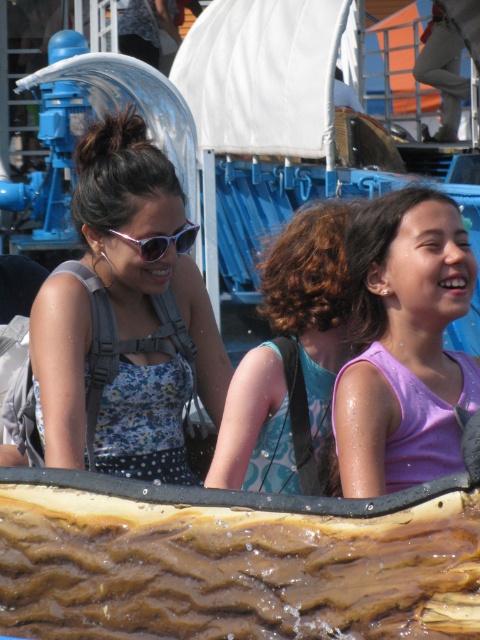
From the picture: Which is more to the right, purple matte tank top at center or teal fabric dress at center?

From the viewer's perspective, purple matte tank top at center appears more on the right side.

Measure the distance between point (408,300) and camera.

Point (408,300) is 32.51 meters from camera.

Is point (392, 227) positioned in front of point (279, 336)?

Yes.

You are a GUI agent. You are given a task and a screenshot of the screen. Output one action in this format:
    pyautogui.click(x=<x>, y=<y>)
    Task: Click on the purple matte tank top at center
    Image resolution: width=480 pixels, height=640 pixels.
    Given the screenshot: What is the action you would take?
    pyautogui.click(x=403, y=340)

Does floral fabric dress at left appear on the right side of purple matte tank top at center?

No, floral fabric dress at left is not to the right of purple matte tank top at center.

Can you confirm if floral fabric dress at left is positioned above purple matte tank top at center?

Yes.

The height and width of the screenshot is (640, 480). Identify the location of floral fabric dress at left. (145, 300).

Locate an element on the screen. The width and height of the screenshot is (480, 640). floral fabric dress at left is located at coordinates (145, 300).

Between teal fabric dress at center and matte pink plastic sunglasses at upper left, which one is positioned higher?

Positioned higher is matte pink plastic sunglasses at upper left.

The width and height of the screenshot is (480, 640). I want to click on teal fabric dress at center, so click(x=290, y=358).